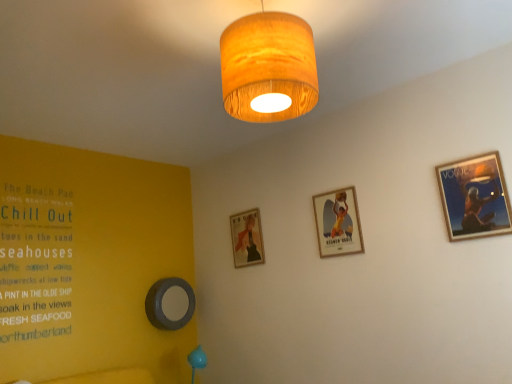
Question: Considering the relative sizes of wooden framed poster at center, placed as the third picture frame when sorted from left to right, and wooden drum lampshade at upper center in the image provided, is wooden framed poster at center, placed as the third picture frame when sorted from left to right, taller than wooden drum lampshade at upper center?

Choices:
 (A) no
 (B) yes

Answer: (A)

Question: Is the surface of wooden framed poster at center, which is the 3th picture frame in back-to-front order, in direct contact with wooden drum lampshade at upper center?

Choices:
 (A) no
 (B) yes

Answer: (A)

Question: Does wooden framed poster at center, placed as the second picture frame when sorted from right to left, have a larger size compared to wooden drum lampshade at upper center?

Choices:
 (A) yes
 (B) no

Answer: (B)

Question: From the image's perspective, is wooden framed poster at center, which is the 3th picture frame in back-to-front order, on top of wooden drum lampshade at upper center?

Choices:
 (A) yes
 (B) no

Answer: (B)

Question: Can you confirm if wooden framed poster at center, the 2th picture frame positioned from the front, is positioned to the right of wooden drum lampshade at upper center?

Choices:
 (A) yes
 (B) no

Answer: (A)

Question: Does wooden drum lampshade at upper center have a lesser height compared to matte gold picture frame at center, which is counted as the 2th picture frame, starting from the back?

Choices:
 (A) no
 (B) yes

Answer: (A)

Question: Is wooden drum lampshade at upper center smaller than matte gold picture frame at center, the third picture frame positioned from the front?

Choices:
 (A) yes
 (B) no

Answer: (B)

Question: From a real-world perspective, is wooden drum lampshade at upper center physically above matte gold picture frame at center, the second picture frame from the left?

Choices:
 (A) no
 (B) yes

Answer: (B)

Question: Can you confirm if wooden drum lampshade at upper center is positioned to the left of matte gold picture frame at center, the second picture frame from the left?

Choices:
 (A) yes
 (B) no

Answer: (B)

Question: Is wooden drum lampshade at upper center closer to the viewer compared to matte gold picture frame at center, the second picture frame from the left?

Choices:
 (A) no
 (B) yes

Answer: (B)

Question: Does wooden drum lampshade at upper center have a lesser width compared to matte gold picture frame at center, which is counted as the 2th picture frame, starting from the back?

Choices:
 (A) yes
 (B) no

Answer: (B)

Question: Could you tell me if matte gold picture frame at center, the third picture frame positioned from the front, is turned towards wooden framed poster at upper right, the 1th picture frame positioned from the front?

Choices:
 (A) no
 (B) yes

Answer: (A)